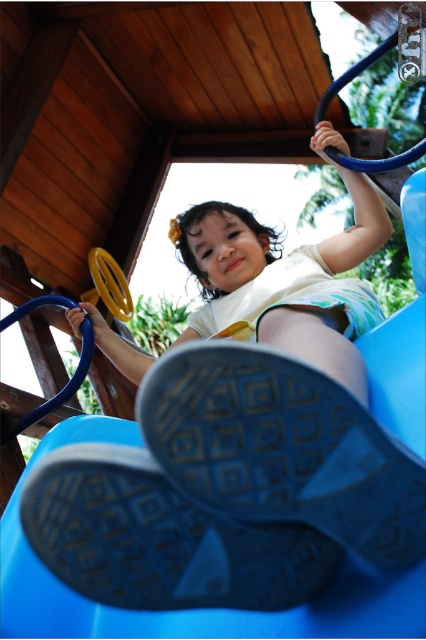
Looking at this image, who is positioned more to the right, matte blue slide at lower center or smooth white shirt at center?

From the viewer's perspective, matte blue slide at lower center appears more on the right side.

Does matte blue slide at lower center appear on the left side of smooth white shirt at center?

No, matte blue slide at lower center is not to the left of smooth white shirt at center.

Does point (330, 531) come farther from viewer compared to point (259, 241)?

No, (330, 531) is closer to viewer.

At what (x,y) coordinates should I click in order to perform the action: click on matte blue slide at lower center. Please return your answer as a coordinate pair (x, y). Looking at the image, I should click on (227, 492).